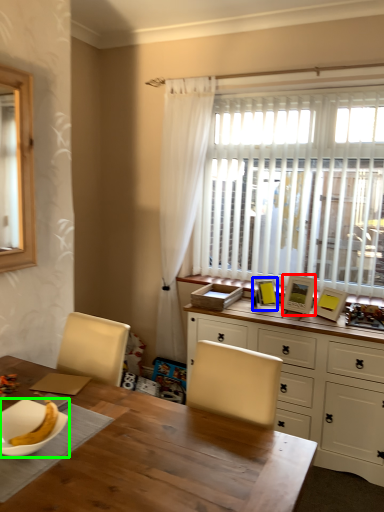
Question: Which object is the closest to the picture frame (highlighted by a red box)? Choose among these: picture frame (highlighted by a blue box) or tableware (highlighted by a green box).

Choices:
 (A) picture frame
 (B) tableware

Answer: (A)